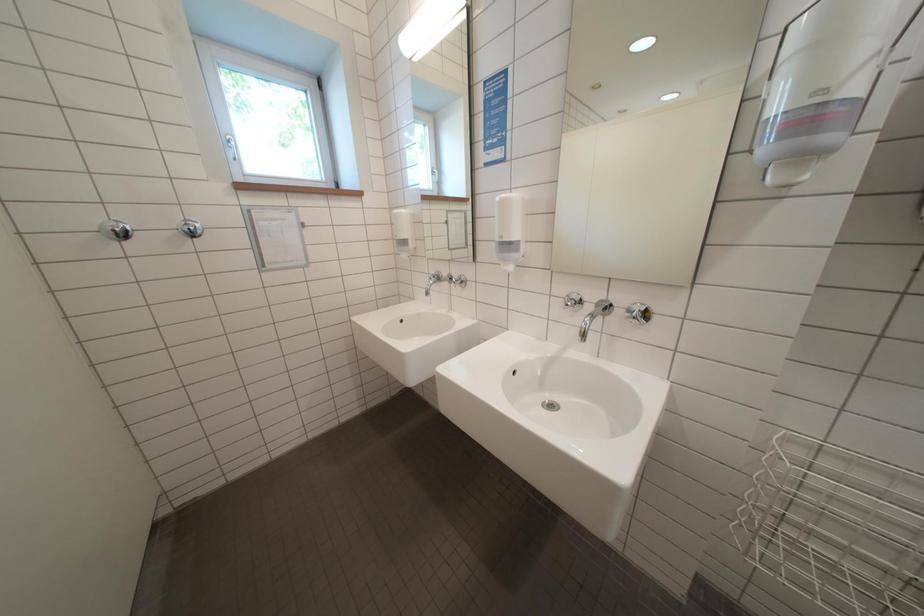
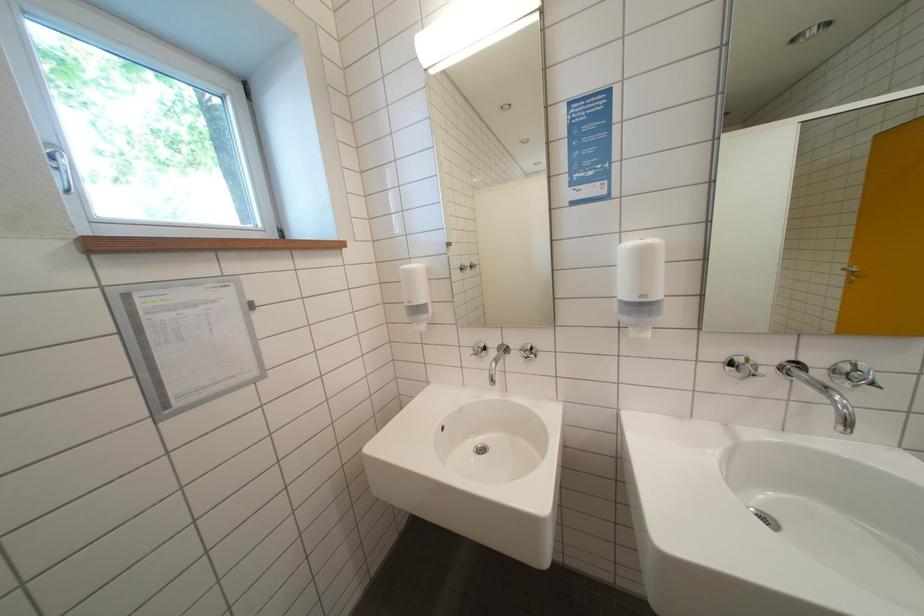
In the scene shown: Which direction would the cameraman need to move to produce the second image?

The cameraman moved toward left, forward.